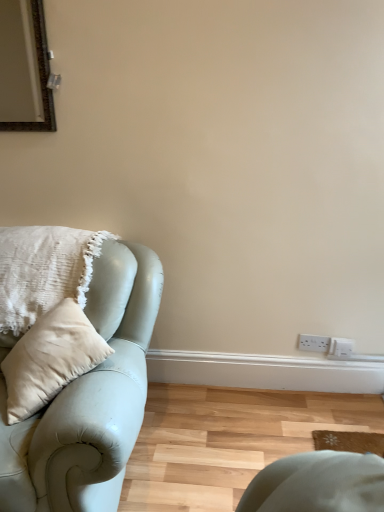
Question: Is white plastic electric outlet at lower right shorter than sage green leather studio couch at left?

Choices:
 (A) yes
 (B) no

Answer: (A)

Question: Is white plastic electric outlet at lower right to the left of sage green leather studio couch at left from the viewer's perspective?

Choices:
 (A) yes
 (B) no

Answer: (B)

Question: Is white plastic electric outlet at lower right positioned before sage green leather studio couch at left?

Choices:
 (A) yes
 (B) no

Answer: (B)

Question: Does white plastic electric outlet at lower right touch sage green leather studio couch at left?

Choices:
 (A) no
 (B) yes

Answer: (A)

Question: From a real-world perspective, is white plastic electric outlet at lower right on top of sage green leather studio couch at left?

Choices:
 (A) no
 (B) yes

Answer: (A)

Question: Does white plastic electric outlet at lower right have a greater height compared to sage green leather studio couch at left?

Choices:
 (A) yes
 (B) no

Answer: (B)

Question: Can you confirm if sage green leather studio couch at left is positioned to the left of white textured cushion at left?

Choices:
 (A) yes
 (B) no

Answer: (B)

Question: Does sage green leather studio couch at left appear on the right side of white textured cushion at left?

Choices:
 (A) yes
 (B) no

Answer: (A)

Question: Is the position of sage green leather studio couch at left more distant than that of white textured cushion at left?

Choices:
 (A) yes
 (B) no

Answer: (B)

Question: From the image's perspective, is sage green leather studio couch at left on white textured cushion at left?

Choices:
 (A) yes
 (B) no

Answer: (B)

Question: From a real-world perspective, is sage green leather studio couch at left physically below white textured cushion at left?

Choices:
 (A) no
 (B) yes

Answer: (B)

Question: Is sage green leather studio couch at left positioned before white textured cushion at left?

Choices:
 (A) no
 (B) yes

Answer: (B)

Question: Is white plastic electric outlet at lower right not near white textured cushion at left?

Choices:
 (A) no
 (B) yes

Answer: (B)